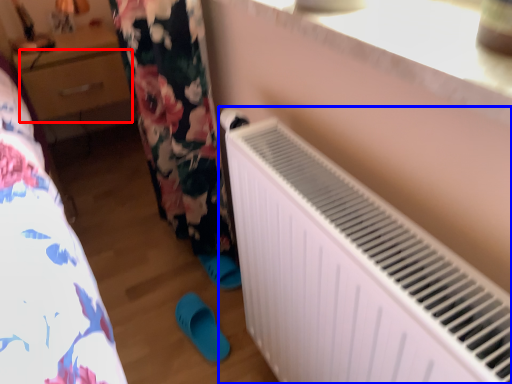
Question: Which of the following is the closest to the observer, drawer (highlighted by a red box) or radiator (highlighted by a blue box)?

Choices:
 (A) drawer
 (B) radiator

Answer: (B)